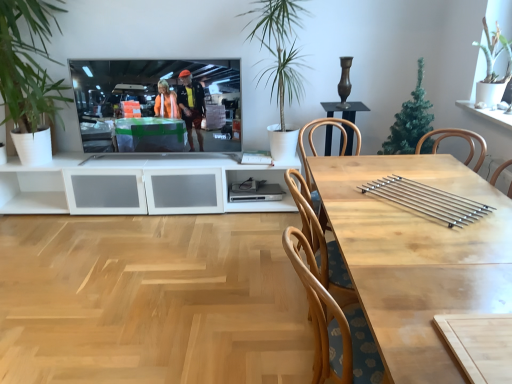
This screenshot has width=512, height=384. What do you see at coordinates (410, 121) in the screenshot?
I see `green artificial tree at upper right, acting as the third houseplant starting from the left` at bounding box center [410, 121].

Describe the element at coordinates (142, 89) in the screenshot. Image resolution: width=512 pixels, height=384 pixels. I see `silver metallic television at center` at that location.

Where is `silver metallic bars at center`? The width and height of the screenshot is (512, 384). silver metallic bars at center is located at coordinates (410, 213).

Measure the distance between point (x=301, y=61) and camera.

3.24 meters.

The width and height of the screenshot is (512, 384). What do you see at coordinates (28, 64) in the screenshot? I see `green leafy plant at left, which is counted as the 4th houseplant, starting from the right` at bounding box center [28, 64].

You are a GUI agent. You are given a task and a screenshot of the screen. Output one action in this format:
    pyautogui.click(x=<x>, y=<y>)
    Task: Click on the green leafy plant at left, the 1th houseplant from the left
    
    Given the screenshot: What is the action you would take?
    pyautogui.click(x=28, y=64)

At what (x,y) coordinates should I click in order to perform the action: click on green leafy plant at upper right, the first houseplant in the right-to-left sequence. Please return your answer as a coordinate pair (x, y). Looking at the image, I should click on (493, 67).

Considering the sizes of green leafy plant at left, which is counted as the 4th houseplant, starting from the right, and green leafy plant at upper right, the first houseplant in the right-to-left sequence, in the image, is green leafy plant at left, which is counted as the 4th houseplant, starting from the right, bigger or smaller than green leafy plant at upper right, the first houseplant in the right-to-left sequence,?

Clearly, green leafy plant at left, which is counted as the 4th houseplant, starting from the right, is larger in size than green leafy plant at upper right, the first houseplant in the right-to-left sequence.

Measure the distance from green leafy plant at left, which is counted as the 4th houseplant, starting from the right, to green leafy plant at upper right, the first houseplant in the right-to-left sequence.

A distance of 2.95 meters exists between green leafy plant at left, which is counted as the 4th houseplant, starting from the right, and green leafy plant at upper right, the first houseplant in the right-to-left sequence.

Would you say green leafy plant at left, which is counted as the 4th houseplant, starting from the right, contains green leafy plant at upper right, the first houseplant in the right-to-left sequence?

That's incorrect, green leafy plant at upper right, the first houseplant in the right-to-left sequence, is not inside green leafy plant at left, which is counted as the 4th houseplant, starting from the right.

Is green leafy plant at left, which is counted as the 4th houseplant, starting from the right, placed right next to green leafy plant at upper right, the first houseplant in the right-to-left sequence?

No.

Considering the relative positions of green leafy plant at left, which is counted as the 4th houseplant, starting from the right, and green leafy plant at upper center, acting as the 3th houseplant starting from the right, in the image provided, is green leafy plant at left, which is counted as the 4th houseplant, starting from the right, to the left or to the right of green leafy plant at upper center, acting as the 3th houseplant starting from the right,?

green leafy plant at left, which is counted as the 4th houseplant, starting from the right, is to the left of green leafy plant at upper center, acting as the 3th houseplant starting from the right.

Choose the correct answer: Is green leafy plant at left, which is counted as the 4th houseplant, starting from the right, inside green leafy plant at upper center, positioned as the 2th houseplant in left-to-right order, or outside it?

green leafy plant at left, which is counted as the 4th houseplant, starting from the right, is outside green leafy plant at upper center, positioned as the 2th houseplant in left-to-right order.

Is green leafy plant at left, which is counted as the 4th houseplant, starting from the right, behind green leafy plant at upper center, acting as the 3th houseplant starting from the right?

No, it is in front of green leafy plant at upper center, acting as the 3th houseplant starting from the right.

Does green leafy plant at upper right, the fourth houseplant positioned from the left, appear on the left side of light wood table at center?

Incorrect, green leafy plant at upper right, the fourth houseplant positioned from the left, is not on the left side of light wood table at center.

Is green leafy plant at upper right, the first houseplant in the right-to-left sequence, further to camera compared to light wood table at center?

Yes, it is.

Would you say green leafy plant at upper right, the first houseplant in the right-to-left sequence, contains light wood table at center?

Definitely not — light wood table at center is not inside green leafy plant at upper right, the first houseplant in the right-to-left sequence.

Is green leafy plant at upper right, the first houseplant in the right-to-left sequence, taller than light wood table at center?

In fact, green leafy plant at upper right, the first houseplant in the right-to-left sequence, may be shorter than light wood table at center.

Consider the image. Is green artificial tree at upper right, acting as the third houseplant starting from the left, with silver metallic bars at center?

They are not placed beside each other.

Is silver metallic bars at center located within green artificial tree at upper right, acting as the third houseplant starting from the left?

No.

From a real-world perspective, is green artificial tree at upper right, acting as the third houseplant starting from the left, physically below silver metallic bars at center?

Incorrect, from a real-world perspective, green artificial tree at upper right, acting as the third houseplant starting from the left, is higher than silver metallic bars at center.

Visually, is green artificial tree at upper right, acting as the 2th houseplant starting from the right, positioned to the left or to the right of silver metallic bars at center?

green artificial tree at upper right, acting as the 2th houseplant starting from the right, is positioned on silver metallic bars at center's left side.

The height and width of the screenshot is (384, 512). I want to click on counter top lying above the light wood table at center (from the image's perspective), so click(x=410, y=213).

Is silver metallic bars at center located within light wood table at center?

Yes, silver metallic bars at center is a part of light wood table at center.

Based on the photo, is light wood table at center looking in the opposite direction of silver metallic bars at center?

Yes.

From a real-world perspective, which object stands above the other?

silver metallic bars at center, from a real-world perspective.

Between point (141, 72) and point (428, 113), which one is positioned in front?

The point (428, 113) is in front.

Can you tell me how much silver metallic television at center and green artificial tree at upper right, acting as the 2th houseplant starting from the right, differ in facing direction?

The facing directions of silver metallic television at center and green artificial tree at upper right, acting as the 2th houseplant starting from the right, are 92 degrees apart.

From the image's perspective, is silver metallic television at center on top of green artificial tree at upper right, acting as the third houseplant starting from the left?

Yes, from the image's perspective, silver metallic television at center is on top of green artificial tree at upper right, acting as the third houseplant starting from the left.

Could you measure the distance between silver metallic television at center and green artificial tree at upper right, acting as the 2th houseplant starting from the right?

silver metallic television at center is 5.19 feet away from green artificial tree at upper right, acting as the 2th houseplant starting from the right.

Find the location of a particular element. the 3rd houseplant positioned below the green leafy plant at upper center, positioned as the 2th houseplant in left-to-right order (from the image's perspective) is located at coordinates (410, 121).

Can you confirm if green artificial tree at upper right, acting as the third houseplant starting from the left, is shorter than green leafy plant at upper center, positioned as the 2th houseplant in left-to-right order?

Yes.

How far apart are green artificial tree at upper right, acting as the 2th houseplant starting from the right, and green leafy plant at upper center, positioned as the 2th houseplant in left-to-right order?

green artificial tree at upper right, acting as the 2th houseplant starting from the right, and green leafy plant at upper center, positioned as the 2th houseplant in left-to-right order, are 36.49 inches apart.

Is green artificial tree at upper right, acting as the third houseplant starting from the left, smaller than green leafy plant at upper center, positioned as the 2th houseplant in left-to-right order?

Yes, green artificial tree at upper right, acting as the third houseplant starting from the left, is smaller than green leafy plant at upper center, positioned as the 2th houseplant in left-to-right order.

Image resolution: width=512 pixels, height=384 pixels. I want to click on houseplant that is the 3rd one when counting rightward from the green leafy plant at left, the 1th houseplant from the left, so click(493, 67).

From the image's perspective, which houseplant is the 2nd one above the green leafy plant at left, which is counted as the 4th houseplant, starting from the right? Please provide its 2D coordinates.

[(279, 58)]

From the picture: Considering their positions, is green artificial tree at upper right, acting as the 2th houseplant starting from the right, positioned closer to green leafy plant at left, which is counted as the 4th houseplant, starting from the right, than green leafy plant at upper center, acting as the 3th houseplant starting from the right?

green leafy plant at upper center, acting as the 3th houseplant starting from the right, lies closer to green leafy plant at left, which is counted as the 4th houseplant, starting from the right, than the other object.

Looking at the image, which one is located further to green artificial tree at upper right, acting as the 2th houseplant starting from the right, green leafy plant at upper center, acting as the 3th houseplant starting from the right, or green leafy plant at left, which is counted as the 4th houseplant, starting from the right?

Among the two, green leafy plant at left, which is counted as the 4th houseplant, starting from the right, is located further to green artificial tree at upper right, acting as the 2th houseplant starting from the right.

Considering their positions, is silver metallic bars at center positioned further to light wood table at center than green artificial tree at upper right, acting as the 2th houseplant starting from the right?

Based on the image, green artificial tree at upper right, acting as the 2th houseplant starting from the right, appears to be further to light wood table at center.

When comparing their distances from silver metallic bars at center, does light wood table at center or silver metallic television at center seem further?

silver metallic television at center.

From the image, which object appears to be farther from green artificial tree at upper right, acting as the third houseplant starting from the left, green leafy plant at upper center, positioned as the 2th houseplant in left-to-right order, or green leafy plant at upper right, the fourth houseplant positioned from the left?

green leafy plant at upper center, positioned as the 2th houseplant in left-to-right order, lies further to green artificial tree at upper right, acting as the third houseplant starting from the left, than the other object.

From the picture: Based on their spatial positions, is green artificial tree at upper right, acting as the 2th houseplant starting from the right, or light wood table at center closer to silver metallic bars at center?

light wood table at center.

Estimate the real-world distances between objects in this image. Which object is further from green leafy plant at upper center, positioned as the 2th houseplant in left-to-right order, silver metallic television at center or silver metallic bars at center?

silver metallic bars at center is positioned further to the anchor green leafy plant at upper center, positioned as the 2th houseplant in left-to-right order.

In the scene shown: Based on their spatial positions, is green leafy plant at upper right, the fourth houseplant positioned from the left, or green leafy plant at upper center, acting as the 3th houseplant starting from the right, further from silver metallic television at center?

Based on the image, green leafy plant at upper right, the fourth houseplant positioned from the left, appears to be further to silver metallic television at center.

At what (x,y) coordinates should I click in order to perform the action: click on counter top located between light wood table at center and green leafy plant at upper center, positioned as the 2th houseplant in left-to-right order, in the depth direction. Please return your answer as a coordinate pair (x, y). This screenshot has height=384, width=512. Looking at the image, I should click on (410, 213).

I want to click on counter top positioned between light wood table at center and green artificial tree at upper right, acting as the third houseplant starting from the left, from near to far, so click(410, 213).

Locate an element on the screen. counter top between light wood table at center and silver metallic television at center along the z-axis is located at coordinates (410, 213).

Find the location of a particular element. The height and width of the screenshot is (384, 512). houseplant between green leafy plant at upper center, acting as the 3th houseplant starting from the right, and green leafy plant at upper right, the first houseplant in the right-to-left sequence is located at coordinates (410, 121).